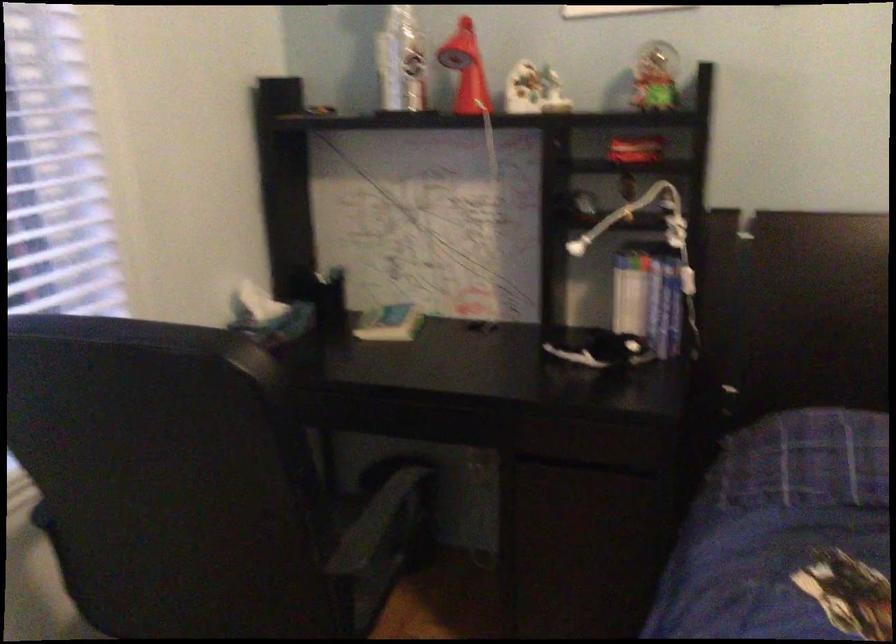
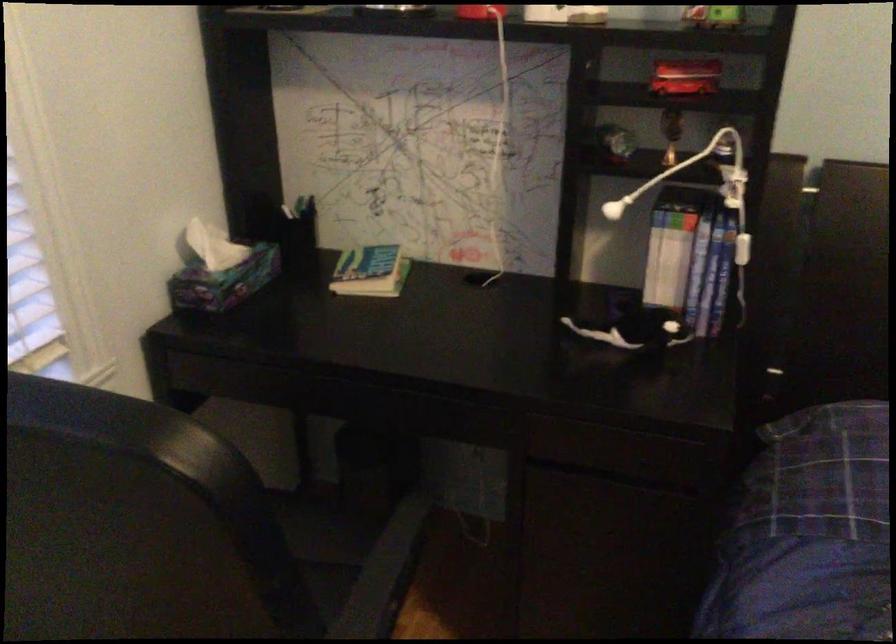
Find the pixel in the second image that matches (270,398) in the first image.

(234, 509)